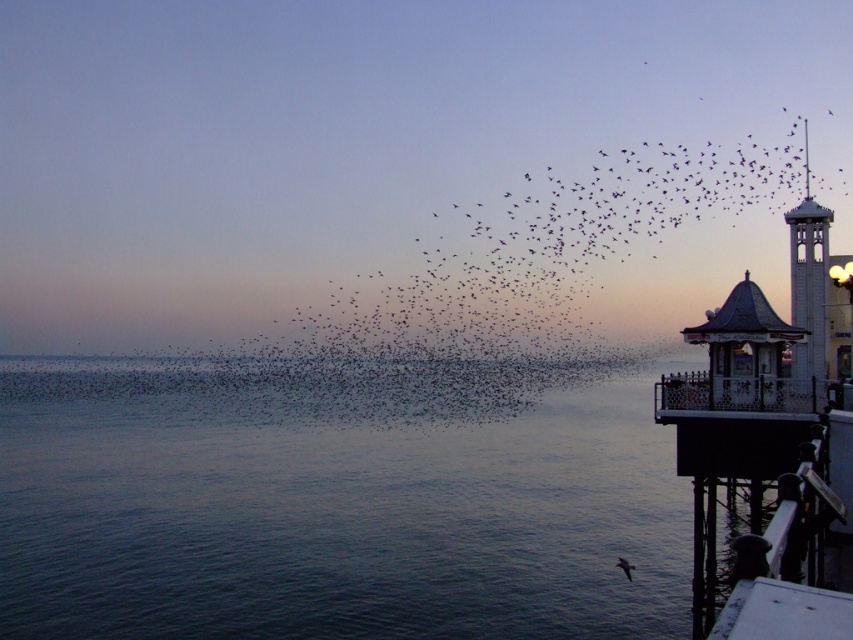
Question: From the image, what is the correct spatial relationship of white wooden bell tower at right in relation to dark gray feathered bird at lower right?

Choices:
 (A) right
 (B) left

Answer: (A)

Question: Is black matte birds at upper center further to the viewer compared to dark gray feathered bird at lower right?

Choices:
 (A) no
 (B) yes

Answer: (A)

Question: Among these objects, which one is nearest to the camera?

Choices:
 (A) dark gray feathered bird at lower right
 (B) clear water at lower left

Answer: (B)

Question: Which object appears closest to the camera in this image?

Choices:
 (A) wooden railing at right
 (B) black matte birds at upper center
 (C) dark gray feathered bird at lower right
 (D) white wooden bell tower at right

Answer: (A)

Question: Can you confirm if clear water at lower left is thinner than dark gray feathered bird at lower right?

Choices:
 (A) yes
 (B) no

Answer: (B)

Question: Which point is farther to the camera?

Choices:
 (A) (618, 563)
 (B) (416, 454)
 (C) (498, 317)

Answer: (C)